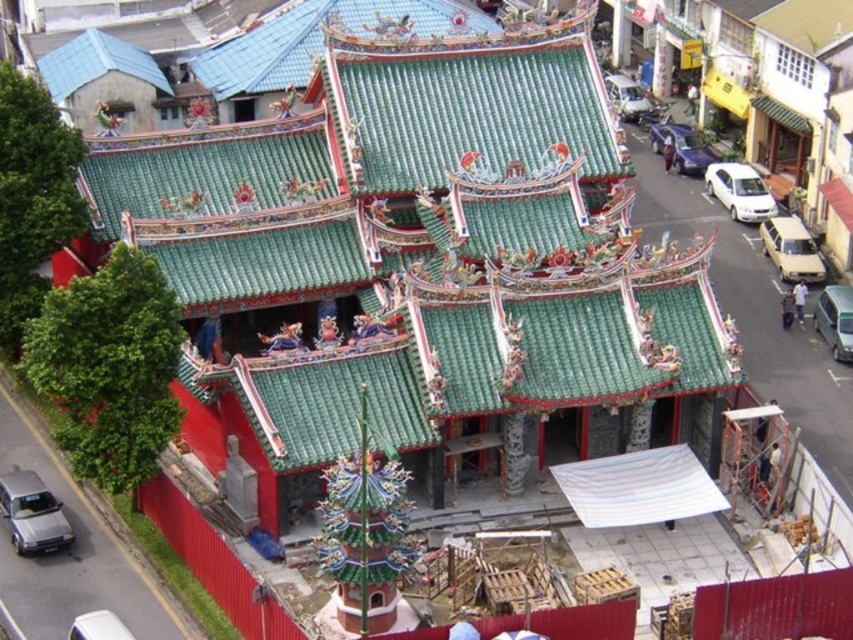
Question: Does white matte sedan at center have a greater width compared to white striped canopy at center?

Choices:
 (A) no
 (B) yes

Answer: (B)

Question: Among these objects, which one is nearest to the camera?

Choices:
 (A) white matte car at right
 (B) yellow matte car at right
 (C) white matte sedan at center
 (D) metallic silver car at center

Answer: (C)

Question: Which point is closer to the camera?

Choices:
 (A) (132, 637)
 (B) (65, 518)
 (C) (772, 282)
 (D) (703, 147)

Answer: (A)

Question: Is yellow matte car at right smaller than white plastic car at lower left?

Choices:
 (A) no
 (B) yes

Answer: (A)

Question: Which point appears farthest from the camera in this image?

Choices:
 (A) (817, 259)
 (B) (113, 625)
 (C) (718, 172)

Answer: (C)

Question: Is silver metallic car at lower left above metallic silver car at center?

Choices:
 (A) no
 (B) yes

Answer: (A)